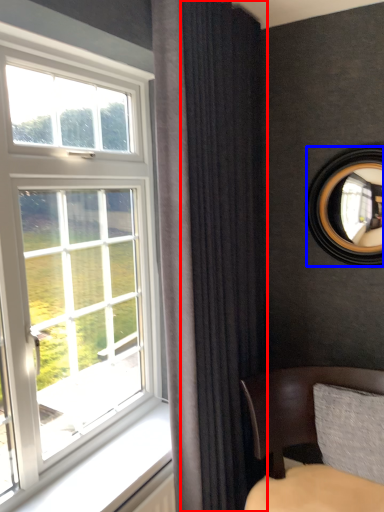
Question: Which point is closer to the camera, curtain (highlighted by a red box) or mirror (highlighted by a blue box)?

Choices:
 (A) curtain
 (B) mirror

Answer: (A)